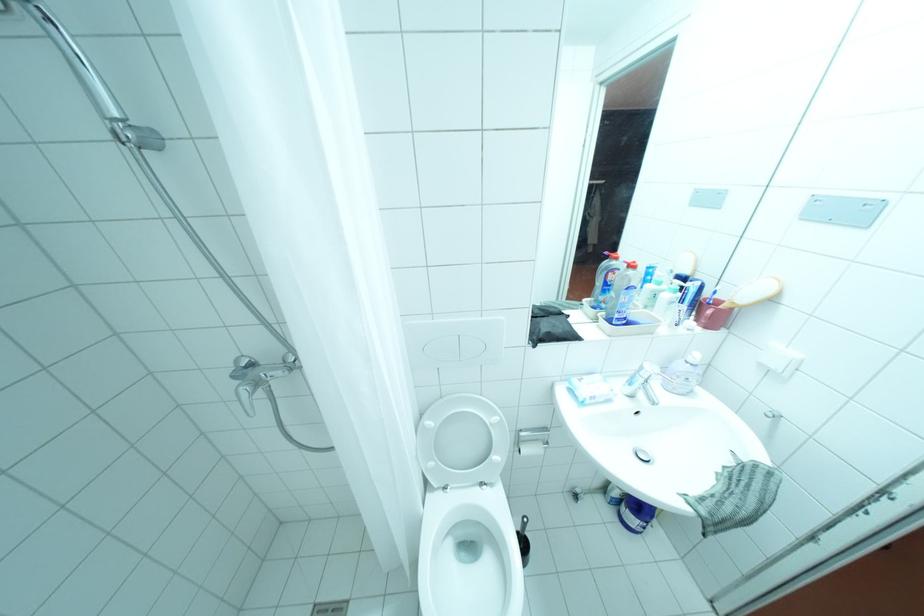
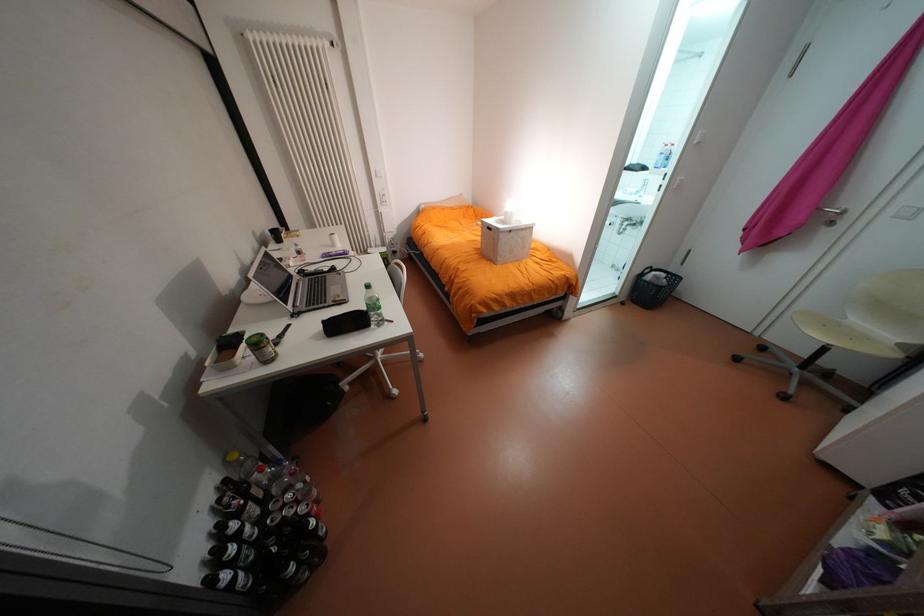
Question: I am providing you with two images of the same scene from different viewpoints. Please identify which objects are invisible in image2.

Choices:
 (A) binder spine hole
 (B) soap dispenser pump
 (C) silver door handle
 (D) black pencil case

Answer: (B)